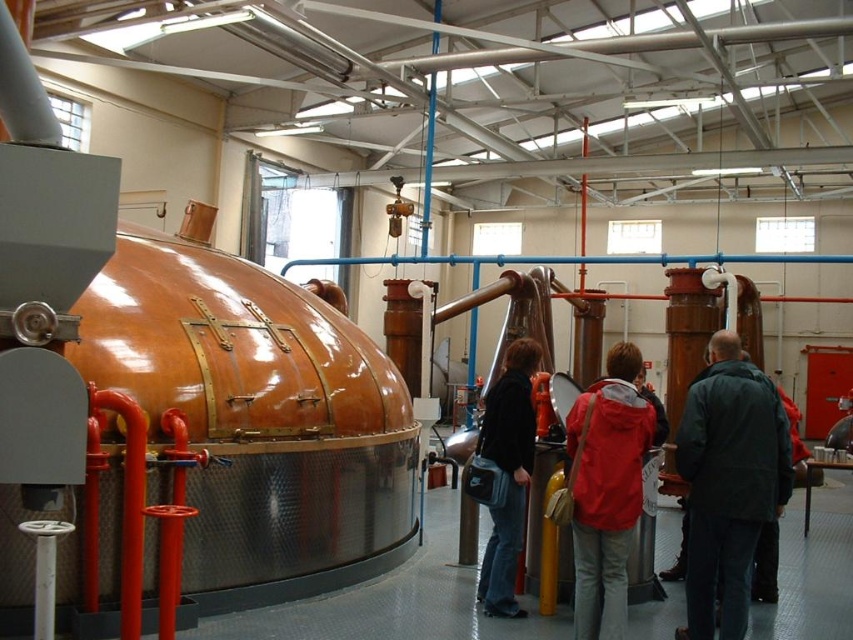
You are a tour guide in the distillery and want to show visitors the dark green jacket at center. Where exactly should you point to locate it?

The dark green jacket at center is located at point 0.756 on the x axis and 0.855 on the y axis.

You are an employee in the distillery and need to hang your jacket on a hook located at the center of the room. You have two jackets, a dark green jacket at center and a red jacket at center. Which jacket will require you to reach higher to hang?

The dark green jacket at center has a greater height compared to the red jacket at center, so you will need to reach higher to hang the dark green jacket at center.

You are a tour guide at the distillery and want to show visitors the jackets worn by the workers. You notice the red jacket at center and the black leather jacket at center. Which jacket takes up more space in the scene?

The red jacket at center is larger in size than the black leather jacket at center, so it takes up more space in the scene.